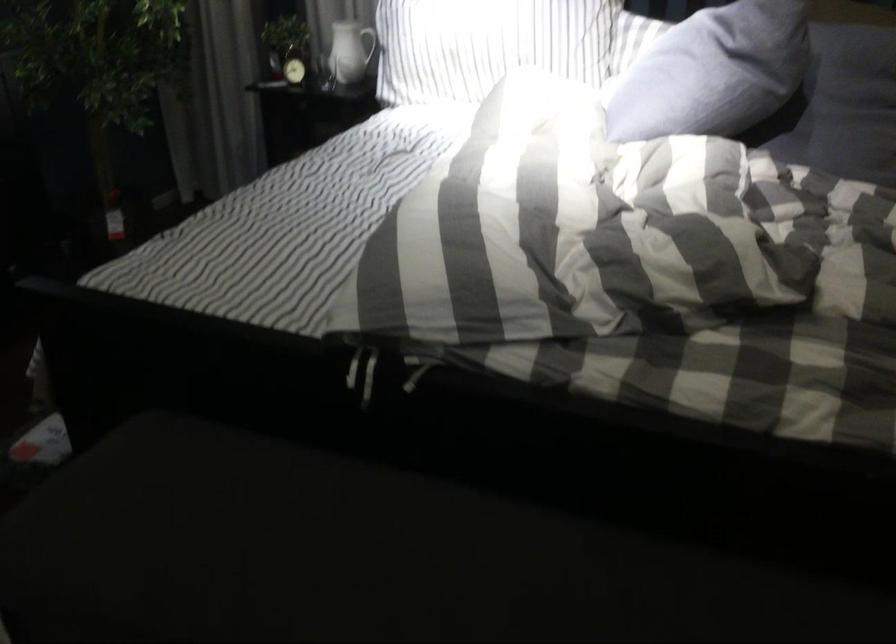
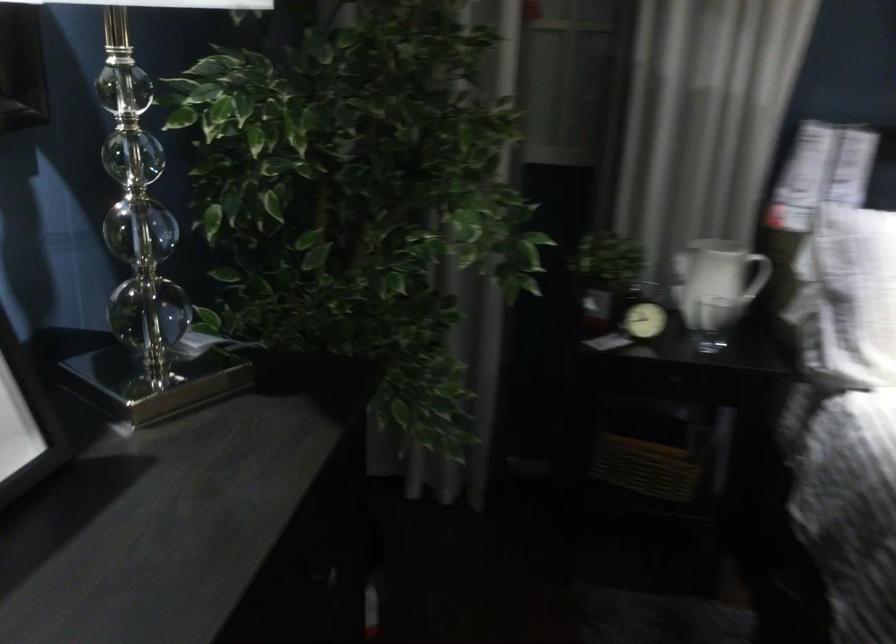
Locate, in the second image, the point that corresponds to [289,68] in the first image.

(643, 321)